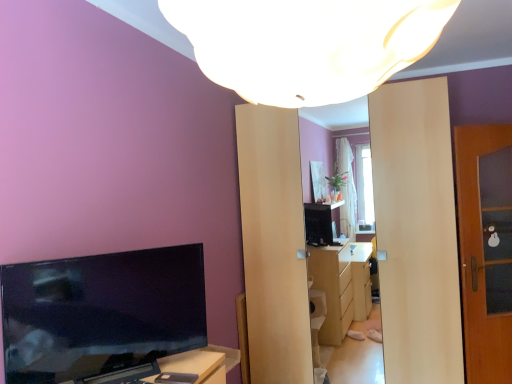
Question: From the image's perspective, is wooden door at right located beneath black glossy tv at left?

Choices:
 (A) yes
 (B) no

Answer: (B)

Question: Is wooden door at right at the right side of black glossy tv at left?

Choices:
 (A) yes
 (B) no

Answer: (A)

Question: From a real-world perspective, is wooden door at right physically above black glossy tv at left?

Choices:
 (A) no
 (B) yes

Answer: (A)

Question: Is wooden door at right thinner than black glossy tv at left?

Choices:
 (A) yes
 (B) no

Answer: (A)

Question: From the image's perspective, is wooden door at right above black glossy tv at left?

Choices:
 (A) no
 (B) yes

Answer: (B)

Question: Can you see wooden door at right touching black glossy tv at left?

Choices:
 (A) yes
 (B) no

Answer: (B)

Question: Is white matte lampshade at upper center to the left of black glossy tv at left from the viewer's perspective?

Choices:
 (A) no
 (B) yes

Answer: (A)

Question: Does white matte lampshade at upper center have a smaller size compared to black glossy tv at left?

Choices:
 (A) yes
 (B) no

Answer: (B)

Question: Are white matte lampshade at upper center and black glossy tv at left making contact?

Choices:
 (A) yes
 (B) no

Answer: (B)

Question: From the image's perspective, is white matte lampshade at upper center on black glossy tv at left?

Choices:
 (A) no
 (B) yes

Answer: (B)

Question: From the image's perspective, is white matte lampshade at upper center below black glossy tv at left?

Choices:
 (A) yes
 (B) no

Answer: (B)

Question: From a real-world perspective, is white matte lampshade at upper center positioned under black glossy tv at left based on gravity?

Choices:
 (A) yes
 (B) no

Answer: (B)

Question: Is black matte mobile phone at lower center next to white matte lampshade at upper center and touching it?

Choices:
 (A) no
 (B) yes

Answer: (A)